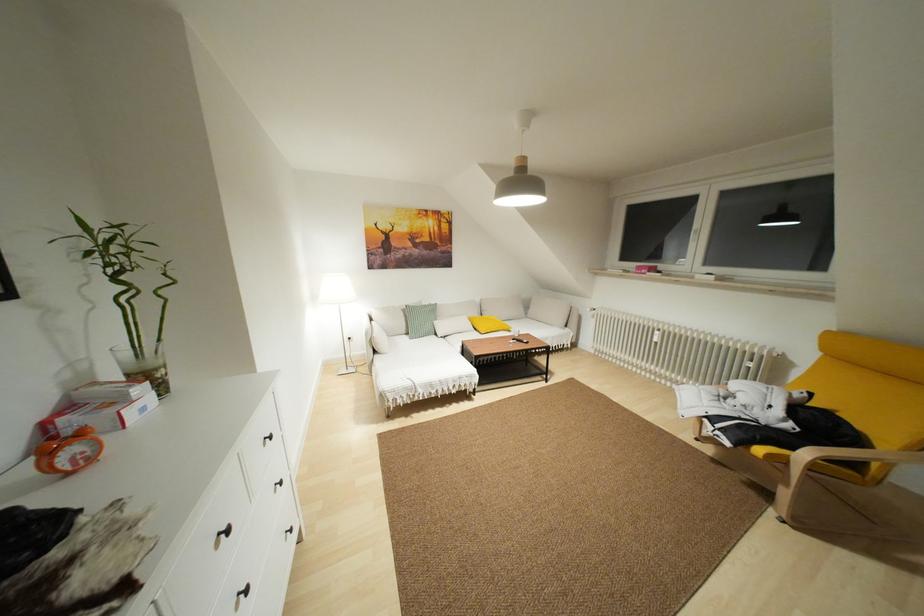
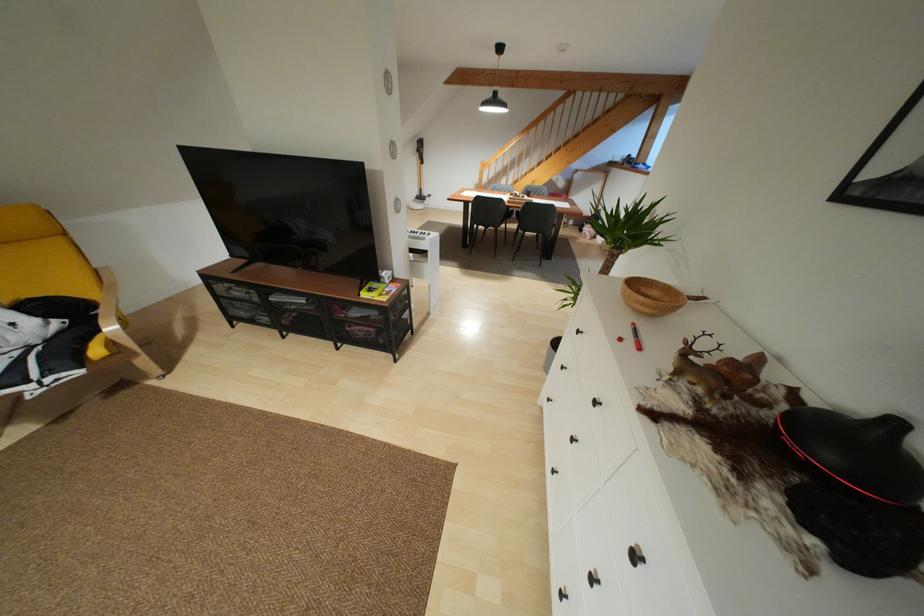
Where in the second image is the point corresponding to (x=781, y=460) from the first image?

(111, 344)